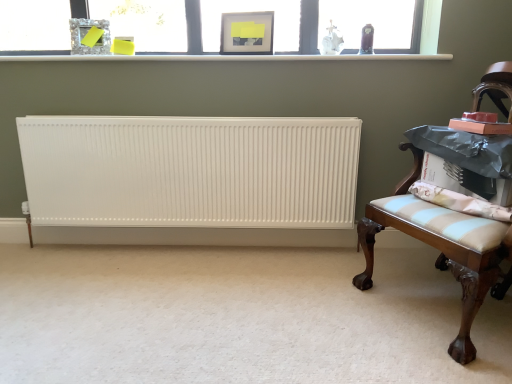
Question: Can you confirm if crystal glass picture frame at upper center, marked as the second picture frame in a right-to-left arrangement, is taller than white plastic window sill at upper center?

Choices:
 (A) yes
 (B) no

Answer: (A)

Question: Is crystal glass picture frame at upper center, marked as the second picture frame in a right-to-left arrangement, behind white plastic window sill at upper center?

Choices:
 (A) no
 (B) yes

Answer: (B)

Question: Can you confirm if crystal glass picture frame at upper center, acting as the first picture frame starting from the left, is bigger than white plastic window sill at upper center?

Choices:
 (A) yes
 (B) no

Answer: (B)

Question: Can you confirm if crystal glass picture frame at upper center, acting as the first picture frame starting from the left, is smaller than white plastic window sill at upper center?

Choices:
 (A) yes
 (B) no

Answer: (A)

Question: Does crystal glass picture frame at upper center, acting as the first picture frame starting from the left, have a greater width compared to white plastic window sill at upper center?

Choices:
 (A) yes
 (B) no

Answer: (B)

Question: From a real-world perspective, is crystal glass picture frame at upper center, marked as the second picture frame in a right-to-left arrangement, beneath white plastic window sill at upper center?

Choices:
 (A) no
 (B) yes

Answer: (A)

Question: Considering the relative sizes of white matte radiator at lower left and white ribbed radiator at center in the image provided, is white matte radiator at lower left thinner than white ribbed radiator at center?

Choices:
 (A) yes
 (B) no

Answer: (B)

Question: Does white matte radiator at lower left lie in front of white ribbed radiator at center?

Choices:
 (A) yes
 (B) no

Answer: (A)

Question: Are white matte radiator at lower left and white ribbed radiator at center located far from each other?

Choices:
 (A) no
 (B) yes

Answer: (A)

Question: From the image's perspective, does white matte radiator at lower left appear higher than white ribbed radiator at center?

Choices:
 (A) yes
 (B) no

Answer: (B)

Question: Can you confirm if white matte radiator at lower left is smaller than white ribbed radiator at center?

Choices:
 (A) no
 (B) yes

Answer: (B)

Question: Is white matte radiator at lower left oriented away from white ribbed radiator at center?

Choices:
 (A) no
 (B) yes

Answer: (A)

Question: Can you confirm if white plastic window sill at upper center is smaller than light blue striped cushion at right?

Choices:
 (A) no
 (B) yes

Answer: (A)